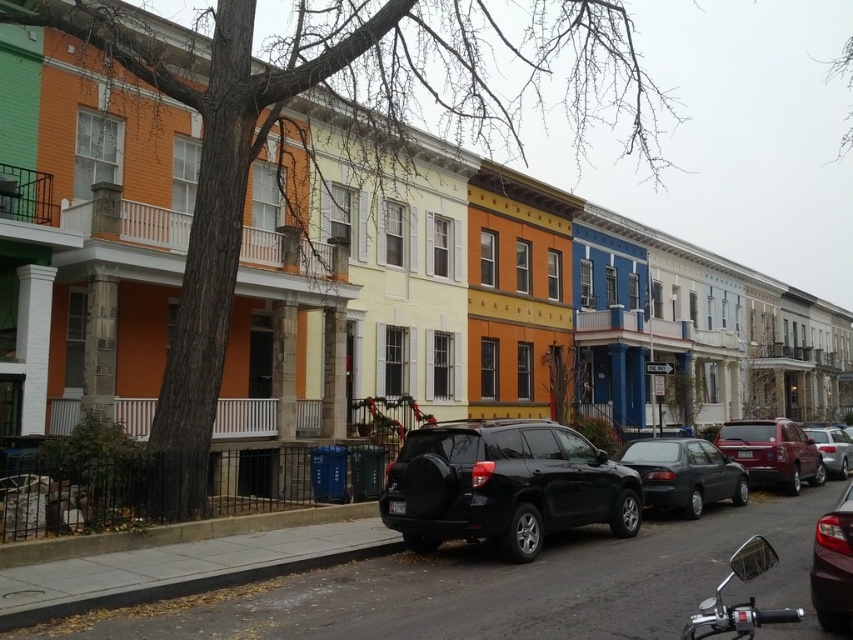
Is black matte suv at center smaller than matte black sedan at center?

Incorrect, black matte suv at center is not smaller in size than matte black sedan at center.

Can you confirm if black matte suv at center is positioned to the left of matte black sedan at center?

Correct, you'll find black matte suv at center to the left of matte black sedan at center.

I want to click on black matte suv at center, so click(503, 484).

Does point (614, 460) come behind point (850, 540)?

Yes.

The image size is (853, 640). Describe the element at coordinates (683, 474) in the screenshot. I see `matte black sedan at center` at that location.

The height and width of the screenshot is (640, 853). I want to click on matte black sedan at center, so click(683, 474).

You are a GUI agent. You are given a task and a screenshot of the screen. Output one action in this format:
    pyautogui.click(x=<x>, y=<y>)
    Task: Click on the shiny red suv at center right
    This screenshot has width=853, height=640.
    Given the screenshot: What is the action you would take?
    pyautogui.click(x=772, y=452)

Between point (798, 435) and point (741, 566), which one is positioned behind?

Point (798, 435)

Who is more forward, (x=759, y=448) or (x=770, y=612)?

Point (x=770, y=612) is in front.

Where is `shiny red suv at center right`? The image size is (853, 640). shiny red suv at center right is located at coordinates (772, 452).